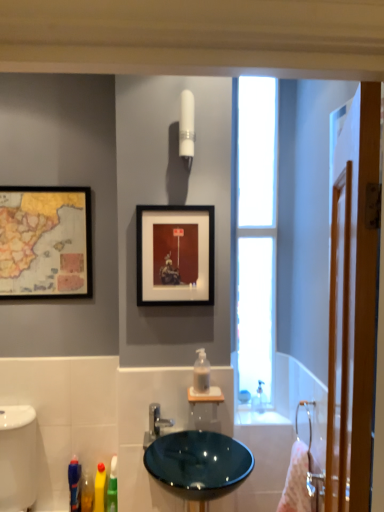
Where is `black matte picture frame at upper center, the 2th picture frame when ordered from back to front`? This screenshot has height=512, width=384. black matte picture frame at upper center, the 2th picture frame when ordered from back to front is located at coordinates (175, 255).

Describe the element at coordinates (155, 424) in the screenshot. I see `satin nickel faucet at center` at that location.

Identify the location of transparent glass window at right. The width and height of the screenshot is (384, 512). pos(256,231).

In the image, is wooden screen door at right on the left side or the right side of transparent glass window at right?

Clearly, wooden screen door at right is on the right of transparent glass window at right in the image.

Consider the image. Is transparent glass window at right a part of wooden screen door at right?

No, transparent glass window at right is not a part of wooden screen door at right.

From a real-world perspective, does wooden screen door at right stand above transparent glass window at right?

No, from a real-world perspective, wooden screen door at right is not above transparent glass window at right.

Find the location of a particular element. The width and height of the screenshot is (384, 512). screen door in front of the transparent glass window at right is located at coordinates (353, 298).

How different are the orientations of black matte picture frame at upper center, which appears as the 2th picture frame when viewed from the left, and transparent glass window at right in degrees?

0.594 degrees separate the facing orientations of black matte picture frame at upper center, which appears as the 2th picture frame when viewed from the left, and transparent glass window at right.

From the image's perspective, is black matte picture frame at upper center, the first picture frame viewed from the front, on top of transparent glass window at right?

Incorrect, from the image's perspective, black matte picture frame at upper center, the first picture frame viewed from the front, is lower than transparent glass window at right.

Considering the sizes of black matte picture frame at upper center, the 2th picture frame when ordered from back to front, and transparent glass window at right in the image, is black matte picture frame at upper center, the 2th picture frame when ordered from back to front, bigger or smaller than transparent glass window at right?

In the image, black matte picture frame at upper center, the 2th picture frame when ordered from back to front, appears to be smaller than transparent glass window at right.

Is black matte picture frame at upper center, which appears as the 2th picture frame when viewed from the left, not close to transparent glass window at right?

That's not correct — black matte picture frame at upper center, which appears as the 2th picture frame when viewed from the left, is a little close to transparent glass window at right.

Is point (183, 139) more distant than point (154, 432)?

No.

Is white glossy light fixture at upper center looking in the opposite direction of satin nickel faucet at center?

No, white glossy light fixture at upper center is not facing away from satin nickel faucet at center.

From the image's perspective, is white glossy light fixture at upper center above or below satin nickel faucet at center?

From the image's perspective, white glossy light fixture at upper center appears above satin nickel faucet at center.

Identify the location of tap below the white glossy light fixture at upper center (from the image's perspective). [x=155, y=424].

Is satin nickel faucet at center thinner than wooden screen door at right?

No.

In the scene shown: Is satin nickel faucet at center next to wooden screen door at right and touching it?

No.

Is satin nickel faucet at center oriented away from wooden screen door at right?

No.

Is satin nickel faucet at center at the left side of wooden screen door at right?

Indeed, satin nickel faucet at center is positioned on the left side of wooden screen door at right.

Is glossy ceramic sink at center taller than transparent glass window at right?

No.

From a real-world perspective, is glossy ceramic sink at center above or below transparent glass window at right?

glossy ceramic sink at center is below transparent glass window at right.

Is glossy ceramic sink at center looking in the opposite direction of transparent glass window at right?

No, transparent glass window at right is not at the back of glossy ceramic sink at center.

Considering the positions of objects transparent glass window at right and pink fabric towel at right in the image provided, who is more to the left, transparent glass window at right or pink fabric towel at right?

transparent glass window at right is more to the left.

Is pink fabric towel at right inside transparent glass window at right?

No, transparent glass window at right does not contain pink fabric towel at right.

From the image's perspective, is transparent glass window at right located beneath pink fabric towel at right?

No.

In terms of width, does transparent glass window at right look wider or thinner when compared to pink fabric towel at right?

Clearly, transparent glass window at right has less width compared to pink fabric towel at right.

In the image, is wooden-framed map at upper left, which is counted as the second picture frame, starting from the right, on the left side or the right side of black matte picture frame at upper center, the 2th picture frame when ordered from back to front?

In the image, wooden-framed map at upper left, which is counted as the second picture frame, starting from the right, appears on the left side of black matte picture frame at upper center, the 2th picture frame when ordered from back to front.

Considering the relative sizes of wooden-framed map at upper left, which is the 1th picture frame from left to right, and black matte picture frame at upper center, the first picture frame viewed from the front, in the image provided, is wooden-framed map at upper left, which is the 1th picture frame from left to right, taller than black matte picture frame at upper center, the first picture frame viewed from the front,?

Indeed, wooden-framed map at upper left, which is the 1th picture frame from left to right, has a greater height compared to black matte picture frame at upper center, the first picture frame viewed from the front.

Which is closer, (4, 264) or (157, 292)?

Positioned in front is point (157, 292).

Can you confirm if wooden-framed map at upper left, which is counted as the second picture frame, starting from the right, is smaller than black matte picture frame at upper center, the first picture frame viewed from the front?

Actually, wooden-framed map at upper left, which is counted as the second picture frame, starting from the right, might be larger than black matte picture frame at upper center, the first picture frame viewed from the front.

Find the location of a particular element. screen door below the transparent glass window at right (from the image's perspective) is located at coordinates pyautogui.click(x=353, y=298).

Locate an element on the screen. the 1st picture frame to the left of the transparent glass window at right, starting your count from the anchor is located at coordinates (175, 255).

From the image, which object appears to be farther from wooden-framed map at upper left, which is the 1th picture frame from left to right, wooden screen door at right or white glossy bidet at lower left?

wooden screen door at right is further to wooden-framed map at upper left, which is the 1th picture frame from left to right.

Looking at the image, which one is located closer to white glossy light fixture at upper center, transparent glass window at right or glossy ceramic sink at center?

Among the two, transparent glass window at right is located nearer to white glossy light fixture at upper center.

When comparing their distances from wooden-framed map at upper left, arranged as the second picture frame when viewed from the front, does white glossy light fixture at upper center or transparent glass window at right seem closer?

Among the two, white glossy light fixture at upper center is located nearer to wooden-framed map at upper left, arranged as the second picture frame when viewed from the front.

Which object lies nearer to the anchor point translucent plastic soap dispenser at center, black matte picture frame at upper center, the first picture frame viewed from the front, or pink fabric towel at right?

Among the two, black matte picture frame at upper center, the first picture frame viewed from the front, is located nearer to translucent plastic soap dispenser at center.

From the picture: From the image, which object appears to be farther from white glossy bidet at lower left, black matte picture frame at upper center, the first picture frame viewed from the front, or satin nickel faucet at center?

The object further to white glossy bidet at lower left is black matte picture frame at upper center, the first picture frame viewed from the front.

When comparing their distances from white glossy bidet at lower left, does wooden screen door at right or translucent plastic soap dispenser at center seem closer?

translucent plastic soap dispenser at center lies closer to white glossy bidet at lower left than the other object.

Estimate the real-world distances between objects in this image. Which object is further from translucent plastic soap dispenser at center, wooden-framed map at upper left, which is counted as the second picture frame, starting from the right, or wooden screen door at right?

wooden screen door at right lies further to translucent plastic soap dispenser at center than the other object.

Considering their positions, is wooden screen door at right positioned closer to glossy ceramic sink at center than transparent glass window at right?

transparent glass window at right is positioned closer to the anchor glossy ceramic sink at center.

Locate an element on the screen. Image resolution: width=384 pixels, height=512 pixels. picture frame between transparent glass window at right and translucent plastic soap dispenser at center vertically is located at coordinates (175, 255).

Find the location of `window between white glossy light fixture at upper center and white glossy bidet at lower left vertically`. window between white glossy light fixture at upper center and white glossy bidet at lower left vertically is located at coordinates (256, 231).

Identify the location of picture frame between wooden-framed map at upper left, which is the 1th picture frame from left to right, and satin nickel faucet at center from top to bottom. click(x=175, y=255).

Find the location of a particular element. picture frame between transparent glass window at right and white glossy bidet at lower left in the up-down direction is located at coordinates (175, 255).